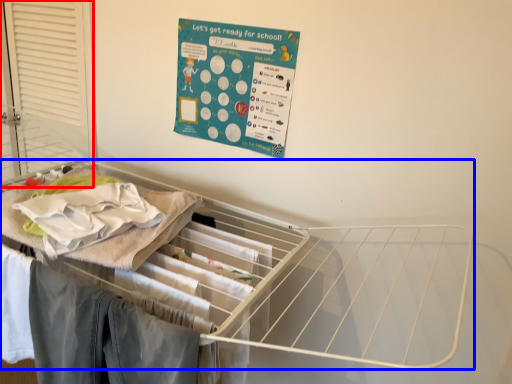
Question: Among these objects, which one is farthest to the camera, screen door (highlighted by a red box) or furniture (highlighted by a blue box)?

Choices:
 (A) screen door
 (B) furniture

Answer: (A)